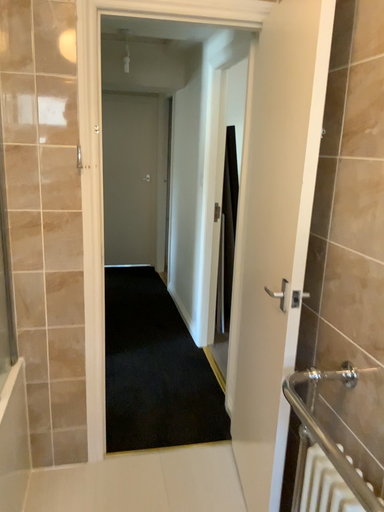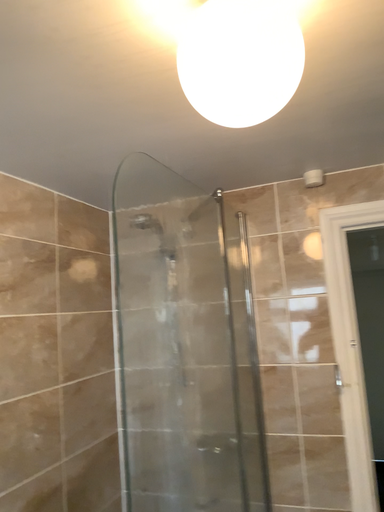
Question: How did the camera likely rotate when shooting the video?

Choices:
 (A) rotated downward
 (B) rotated upward

Answer: (B)